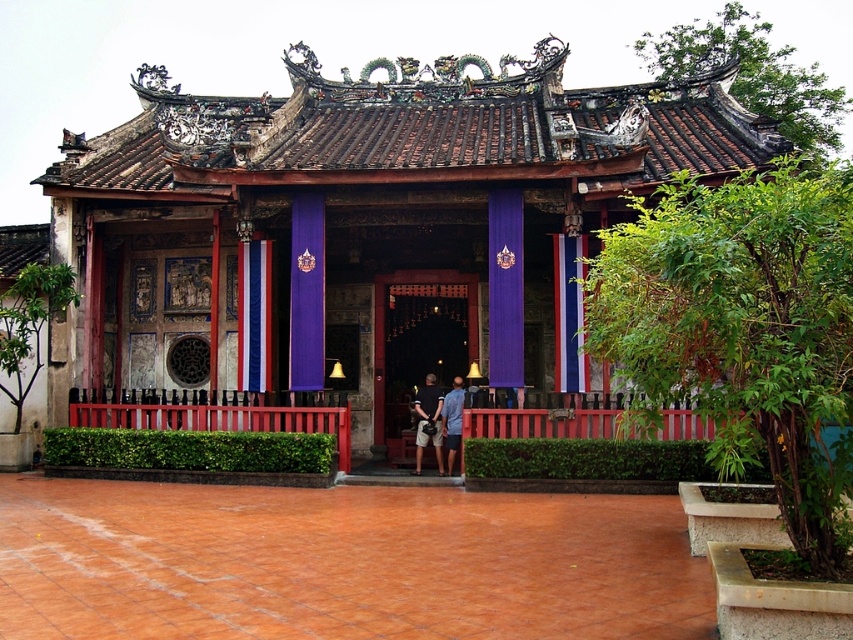
Question: Which of the following is the closest to the observer?

Choices:
 (A) polished wood temple at center
 (B) matte gray shirt at center
 (C) polished wood door at center
 (D) blue denim shorts at center

Answer: (A)

Question: Estimate the real-world distances between objects in this image. Which object is closer to the polished wood temple at center?

Choices:
 (A) blue denim shorts at center
 (B) polished wood door at center

Answer: (B)

Question: Can you confirm if polished wood temple at center is positioned below polished wood door at center?

Choices:
 (A) no
 (B) yes

Answer: (A)

Question: Is polished wood door at center below blue denim shorts at center?

Choices:
 (A) yes
 (B) no

Answer: (B)

Question: Which object appears farthest from the camera in this image?

Choices:
 (A) polished wood door at center
 (B) matte gray shirt at center
 (C) blue denim shorts at center

Answer: (A)

Question: Does polished wood temple at center have a greater width compared to matte gray shirt at center?

Choices:
 (A) no
 (B) yes

Answer: (B)